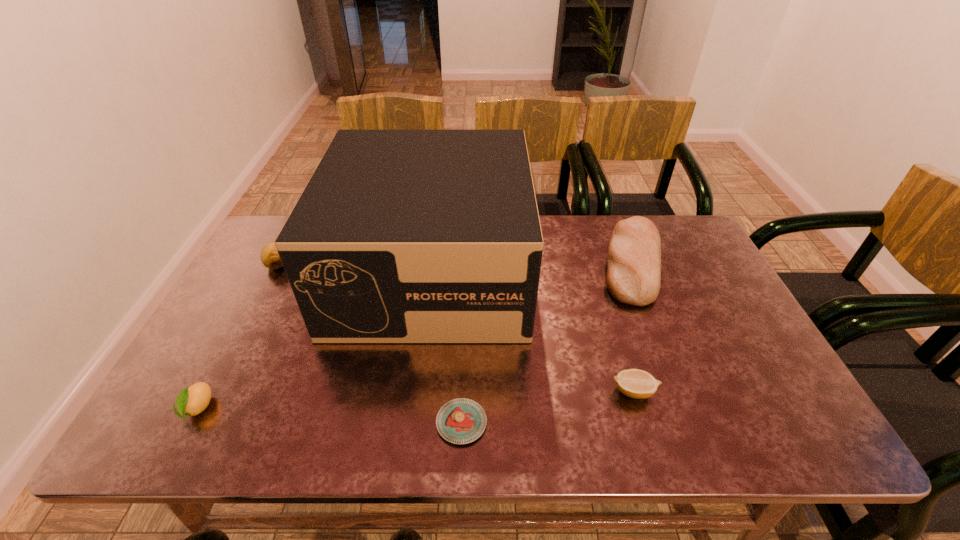
Find the location of a particular element. The height and width of the screenshot is (540, 960). vacant space located on the back of the shortest object is located at coordinates (464, 361).

The image size is (960, 540). I want to click on box situated at the far edge, so click(400, 236).

Find the location of a particular element. bread located in the far edge section of the desktop is located at coordinates (633, 277).

Where is `lemon present at the far edge`? This screenshot has height=540, width=960. lemon present at the far edge is located at coordinates (270, 258).

This screenshot has width=960, height=540. Identify the location of lemon present at the near edge. (191, 401).

This screenshot has width=960, height=540. I want to click on pastry that is at the near edge, so click(460, 421).

Identify the location of object present at the right edge. The image size is (960, 540). (633, 277).

I want to click on object that is positioned at the far left corner, so click(x=270, y=258).

Identify the location of object that is at the near left corner. This screenshot has height=540, width=960. (191, 401).

Find the location of `object that is at the far right corner`. object that is at the far right corner is located at coordinates (633, 277).